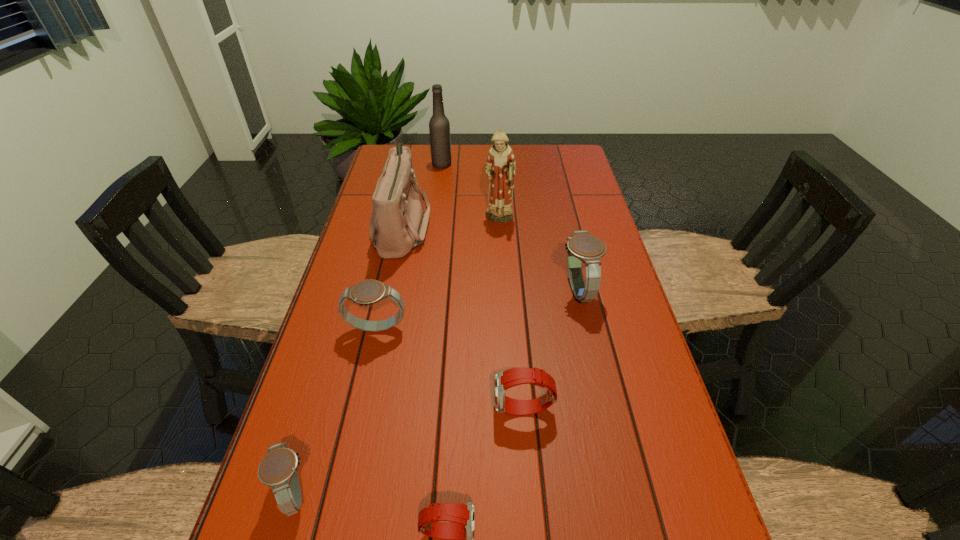
This screenshot has width=960, height=540. Find the location of `watch that is the third nearest to the left red watch`. watch that is the third nearest to the left red watch is located at coordinates (367, 292).

I want to click on watch that is the second closest to the shortest watch, so click(x=278, y=469).

The image size is (960, 540). Identify the location of the second closest gray watch to the right red watch. (367, 292).

Where is `the second closest gray watch to the shoulder bag`? This screenshot has height=540, width=960. the second closest gray watch to the shoulder bag is located at coordinates (582, 246).

Find the location of `vacant space that satisfies the following two spatial constraints: 1. on the face of the right red watch; 2. on the front side of the smallest gray watch`. vacant space that satisfies the following two spatial constraints: 1. on the face of the right red watch; 2. on the front side of the smallest gray watch is located at coordinates (530, 492).